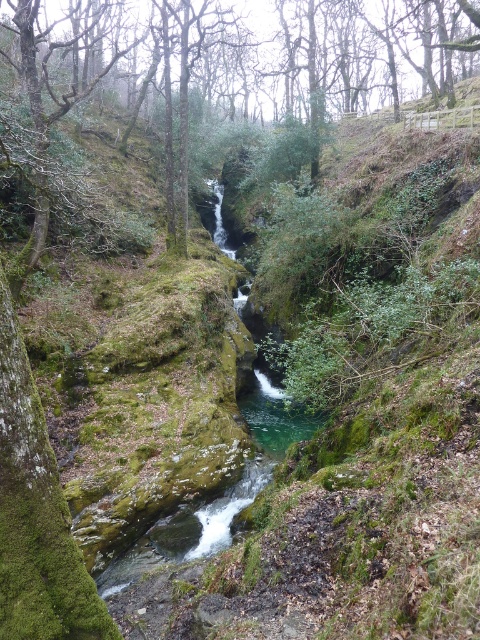
Question: Observing the image, what is the correct spatial positioning of green mossy rock at center in reference to clear water at center?

Choices:
 (A) right
 (B) left

Answer: (B)

Question: Is the position of green mossy rock at center less distant than that of clear water at center?

Choices:
 (A) no
 (B) yes

Answer: (B)

Question: Can you confirm if green mossy rock at center is positioned to the left of clear water at center?

Choices:
 (A) yes
 (B) no

Answer: (A)

Question: Among these points, which one is nearest to the camera?

Choices:
 (A) (277, 378)
 (B) (271, 38)

Answer: (A)

Question: Among these points, which one is nearest to the camera?

Choices:
 (A) (40, 168)
 (B) (282, 452)

Answer: (A)